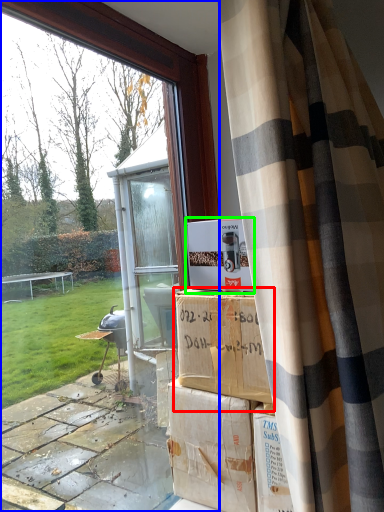
Question: Considering the real-world distances, which object is farthest from cardboard box (highlighted by a red box)? window (highlighted by a blue box) or cardboard box (highlighted by a green box)?

Choices:
 (A) window
 (B) cardboard box

Answer: (A)